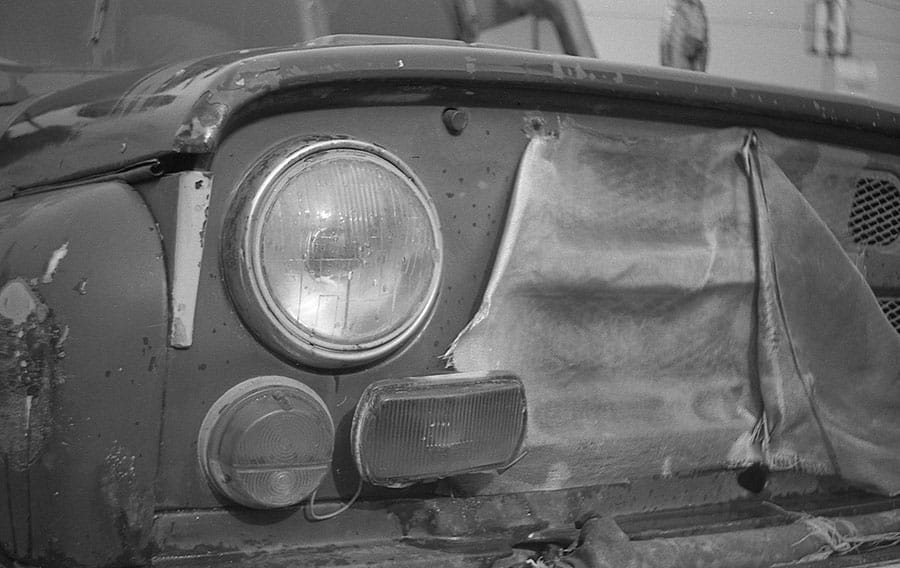
Identify the location of fabric. The width and height of the screenshot is (900, 568). (675, 380).